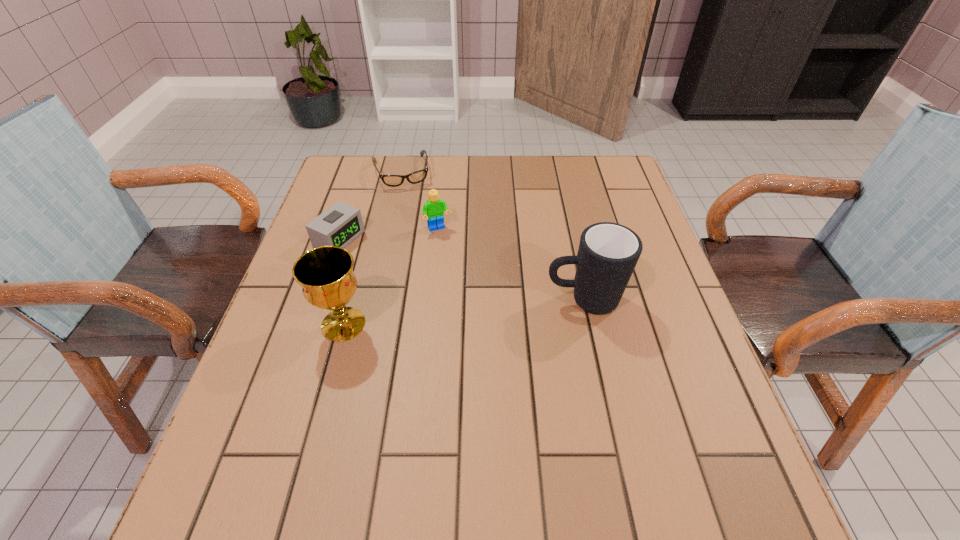
You are a GUI agent. You are given a task and a screenshot of the screen. Output one action in this format:
    pyautogui.click(x=<x>, y=<y>)
    Task: Click on the vacant area situated 0.380m on the side of the rightmost object with the handle
    The height and width of the screenshot is (540, 960).
    Given the screenshot: What is the action you would take?
    pyautogui.click(x=375, y=300)

At what (x,y) coordinates should I click in order to perform the action: click on vacant area situated on the face of the third tallest object. Please return your answer as a coordinate pair (x, y). Looking at the image, I should click on (460, 271).

In order to click on free space located on the face of the third tallest object in this screenshot , I will do `click(477, 306)`.

At what (x,y) coordinates should I click in order to perform the action: click on vacant space located 0.060m on the face of the third tallest object. Please return your answer as a coordinate pair (x, y). Looking at the image, I should click on (449, 249).

At what (x,y) coordinates should I click in order to perform the action: click on vacant space located 0.090m on the front-facing side of the alarm clock. Please return your answer as a coordinate pair (x, y). Looking at the image, I should click on (385, 261).

At what (x,y) coordinates should I click in order to perform the action: click on free space located on the front-facing side of the alarm clock. Please return your answer as a coordinate pair (x, y). This screenshot has height=540, width=960. Looking at the image, I should click on (484, 307).

Where is `vacant space located 0.230m on the front-facing side of the alarm clock`? The width and height of the screenshot is (960, 540). vacant space located 0.230m on the front-facing side of the alarm clock is located at coordinates (432, 283).

Locate an element on the screen. vacant area situated on the front-facing side of the shortest object is located at coordinates (410, 205).

Find the location of a particular element. blank space located on the front-facing side of the shortest object is located at coordinates (419, 237).

In order to click on vacant area located 0.100m on the front-facing side of the shortest object in this screenshot , I will do `click(411, 210)`.